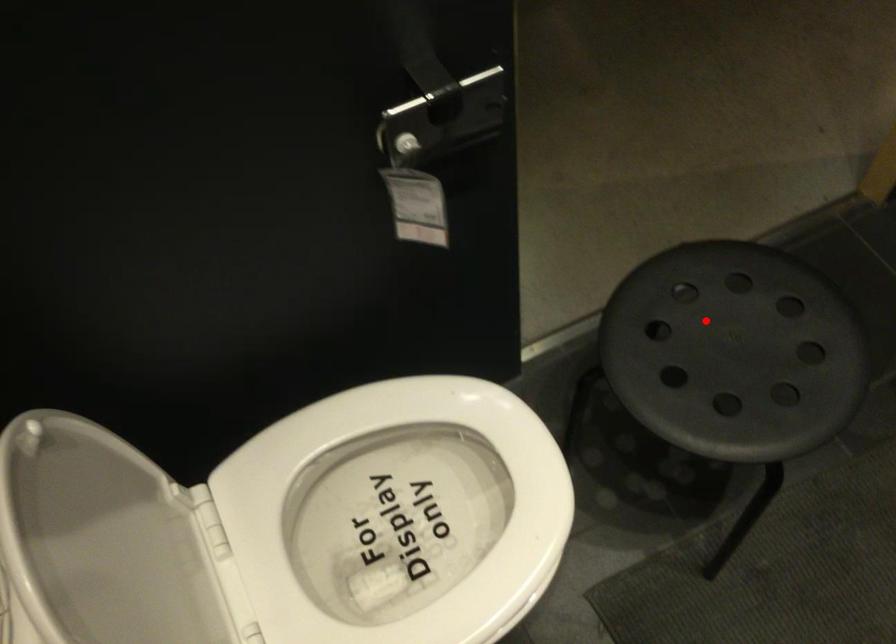
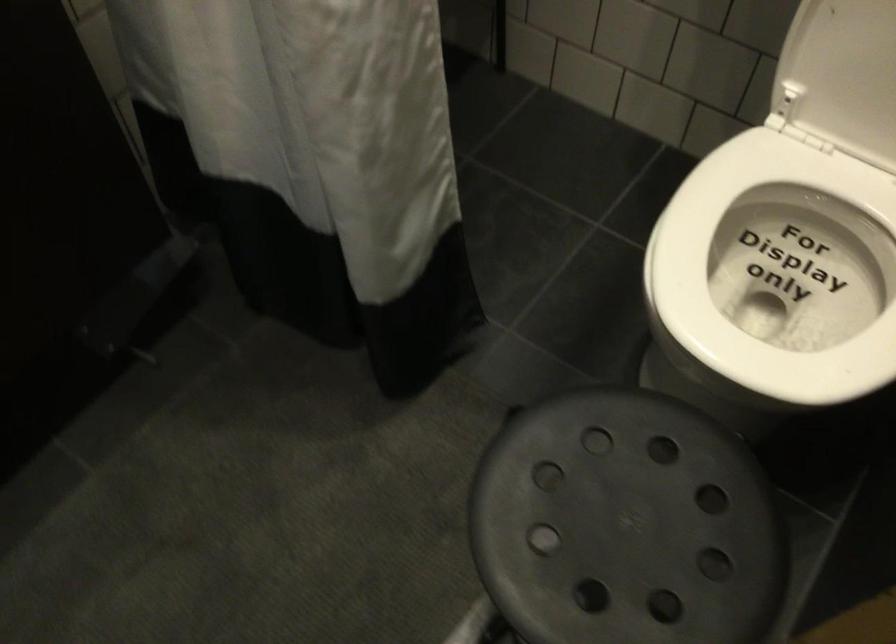
Question: A red point is marked in image1. In image2, is the corresponding 3D point closer to the camera or farther? Reply with the corresponding letter.

Choices:
 (A) The corresponding 3D point is closer.
 (B) The corresponding 3D point is farther.

Answer: (A)